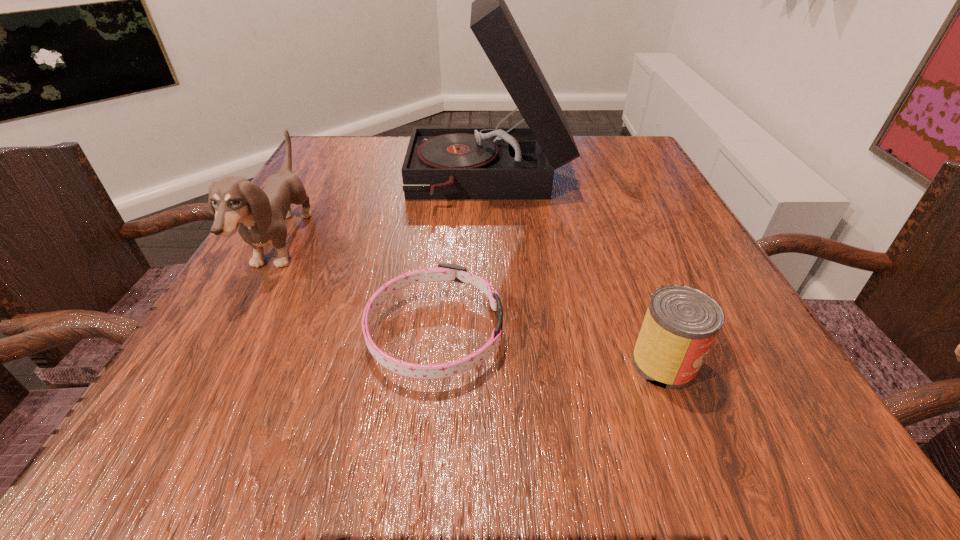
This screenshot has height=540, width=960. I want to click on vacant position in the image that satisfies the following two spatial constraints: 1. at the face of the puppy; 2. on the back side of the can, so click(214, 363).